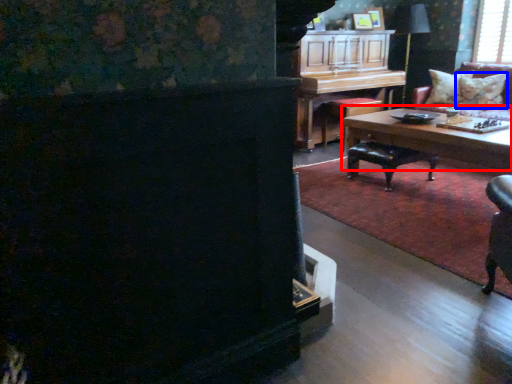
Question: Which point is closer to the camera, coffee table (highlighted by a red box) or pillow (highlighted by a blue box)?

Choices:
 (A) coffee table
 (B) pillow

Answer: (A)